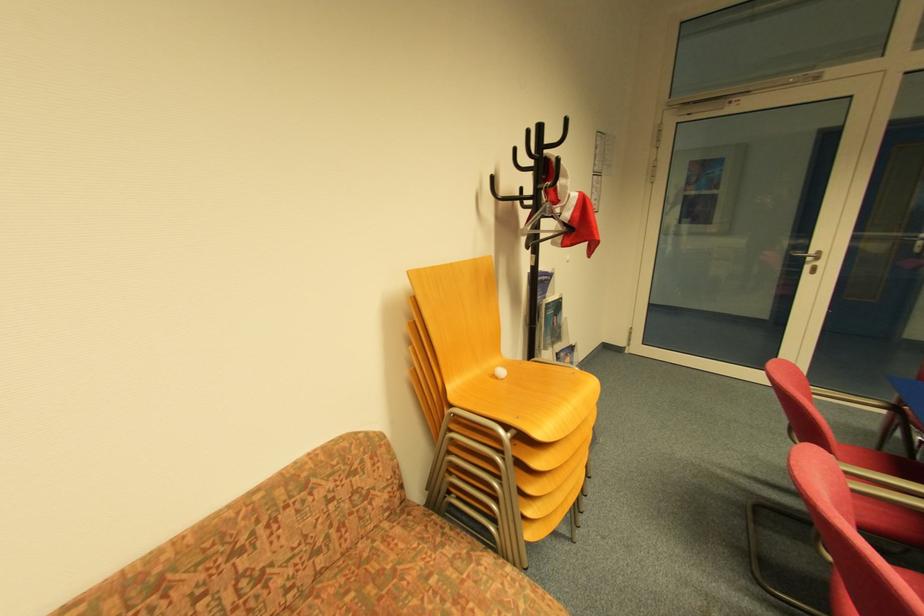
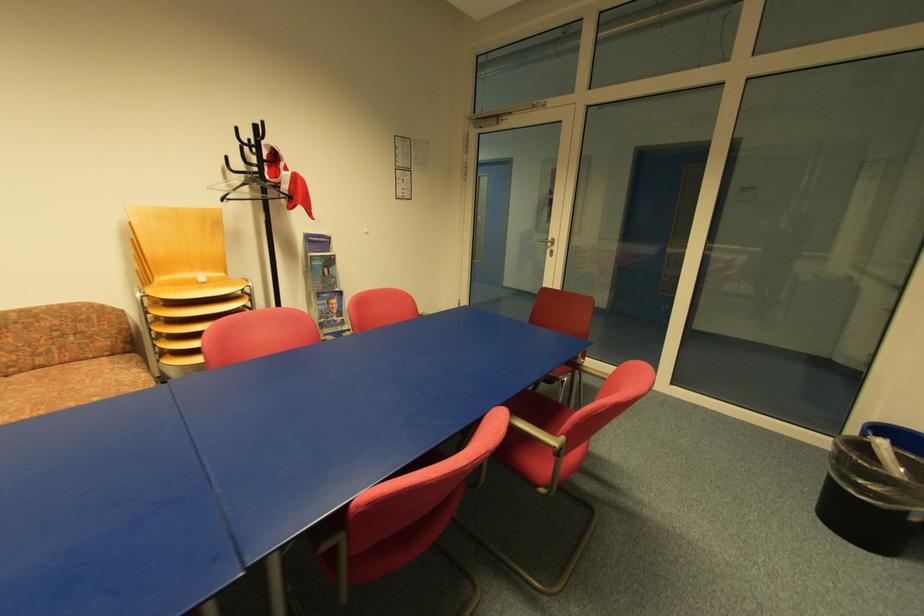
In a continuous first-person perspective shot, in which direction is the camera moving?

The movement direction of the cameraman is right, backward.